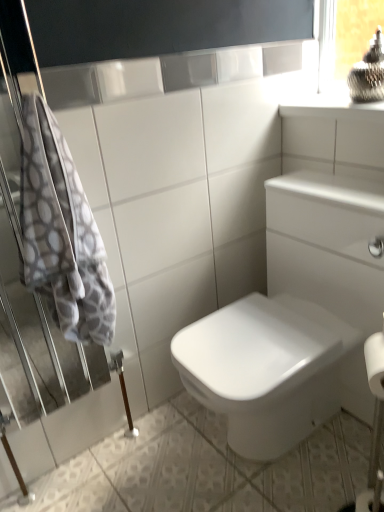
What is the approximate height of white textured towel at left?

The height of white textured towel at left is 29.63 inches.

What do you see at coordinates (345, 35) in the screenshot? I see `clear glass window frame at upper right` at bounding box center [345, 35].

Where is `white textured towel at left`? The width and height of the screenshot is (384, 512). white textured towel at left is located at coordinates (62, 233).

Can we say clear glass window frame at upper right lies outside white glossy ceramic tile at center?

Yes, clear glass window frame at upper right is not within white glossy ceramic tile at center.

Considering the sizes of clear glass window frame at upper right and white glossy ceramic tile at center in the image, is clear glass window frame at upper right bigger or smaller than white glossy ceramic tile at center?

In the image, clear glass window frame at upper right appears to be smaller than white glossy ceramic tile at center.

Which is in front, clear glass window frame at upper right or white glossy ceramic tile at center?

white glossy ceramic tile at center is in front.

Is point (333, 72) positioned before point (115, 451)?

No, it is not.

Between white textured towel at left and clear glass window frame at upper right, which one appears on the right side from the viewer's perspective?

clear glass window frame at upper right.

Is point (49, 118) closer or farther from the camera than point (379, 11)?

Clearly, point (49, 118) is closer to the camera than point (379, 11).

Is white textured towel at left taller than clear glass window frame at upper right?

→ Yes.

Which of these two, white textured towel at left or clear glass window frame at upper right, is smaller?

Smaller between the two is clear glass window frame at upper right.

Between white glossy ceramic tile at center and white textured towel at left, which one is positioned behind?

Positioned behind is white textured towel at left.

Is white glossy ceramic tile at center bigger or smaller than white textured towel at left?

white glossy ceramic tile at center is smaller than white textured towel at left.

Is white glossy ceramic tile at center positioned with its back to white textured towel at left?

That's not correct — white glossy ceramic tile at center is not looking away from white textured towel at left.

Can you confirm if white glossy ceramic tile at center is taller than white textured towel at left?

Incorrect, the height of white glossy ceramic tile at center is not larger of that of white textured towel at left.

Is white glossy ceramic tile at center closer to camera compared to clear glass window frame at upper right?

Yes, the depth of white glossy ceramic tile at center is less than that of clear glass window frame at upper right.

Does white glossy ceramic tile at center have a lesser width compared to clear glass window frame at upper right?

Incorrect, the width of white glossy ceramic tile at center is not less than that of clear glass window frame at upper right.

Find the location of a particular element. window frame located above the white glossy ceramic tile at center (from the image's perspective) is located at coordinates (345, 35).

Is white glossy ceramic tile at center facing away from clear glass window frame at upper right?

No, white glossy ceramic tile at center's orientation is not away from clear glass window frame at upper right.

From a real-world perspective, which is physically below, white textured towel at left or white glossy ceramic tile at center?

In real-world perspective, white glossy ceramic tile at center is lower.

Looking at the image, does white textured towel at left seem bigger or smaller compared to white glossy ceramic tile at center?

white textured towel at left is bigger than white glossy ceramic tile at center.

Which object is further away from the camera, white textured towel at left or white glossy ceramic tile at center?

white textured towel at left is more distant.

Is white textured towel at left facing towards white glossy ceramic tile at center?

No, white textured towel at left is not facing towards white glossy ceramic tile at center.

Considering their positions, is clear glass window frame at upper right located in front of or behind white textured towel at left?

clear glass window frame at upper right is behind white textured towel at left.

Can you confirm if clear glass window frame at upper right is shorter than white textured towel at left?

Yes.

Locate an element on the screen. ceramic tile below the clear glass window frame at upper right (from the image's perspective) is located at coordinates (207, 469).

Locate an element on the screen. The width and height of the screenshot is (384, 512). window frame behind the white textured towel at left is located at coordinates (345, 35).

Based on their spatial positions, is white glossy ceramic tile at center or clear glass window frame at upper right closer to white textured towel at left?

white glossy ceramic tile at center.

Estimate the real-world distances between objects in this image. Which object is further from clear glass window frame at upper right, white glossy ceramic tile at center or white textured towel at left?

The object further to clear glass window frame at upper right is white glossy ceramic tile at center.

Estimate the real-world distances between objects in this image. Which object is further from white glossy ceramic tile at center, white textured towel at left or clear glass window frame at upper right?

Based on the image, clear glass window frame at upper right appears to be further to white glossy ceramic tile at center.

Consider the image. When comparing their distances from white textured towel at left, does clear glass window frame at upper right or white glossy ceramic tile at center seem further?

Based on the image, clear glass window frame at upper right appears to be further to white textured towel at left.

Estimate the real-world distances between objects in this image. Which object is closer to clear glass window frame at upper right, white textured towel at left or white glossy ceramic tile at center?

Among the two, white textured towel at left is located nearer to clear glass window frame at upper right.

Estimate the real-world distances between objects in this image. Which object is closer to white glossy ceramic tile at center, clear glass window frame at upper right or white textured towel at left?

white textured towel at left.

Identify the location of bath towel between clear glass window frame at upper right and white glossy ceramic tile at center vertically. The image size is (384, 512). (62, 233).